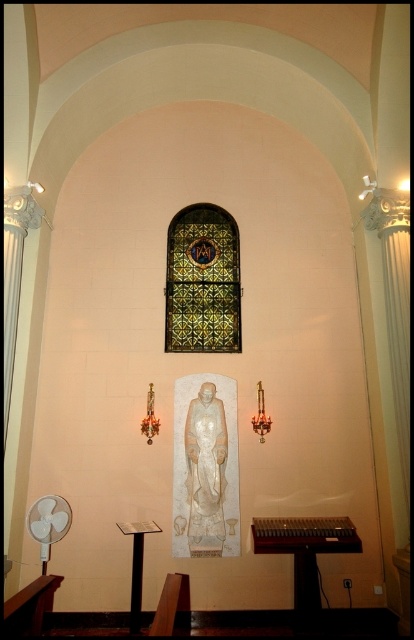
Can you confirm if green stained glass at center is positioned above wooden table at lower center?

Yes, green stained glass at center is above wooden table at lower center.

Which is in front, point (195, 314) or point (308, 563)?

Point (308, 563) is more forward.

You are a GUI agent. You are given a task and a screenshot of the screen. Output one action in this format:
    pyautogui.click(x=<x>, y=<y>)
    Task: Click on the green stained glass at center
    
    Given the screenshot: What is the action you would take?
    pyautogui.click(x=202, y=282)